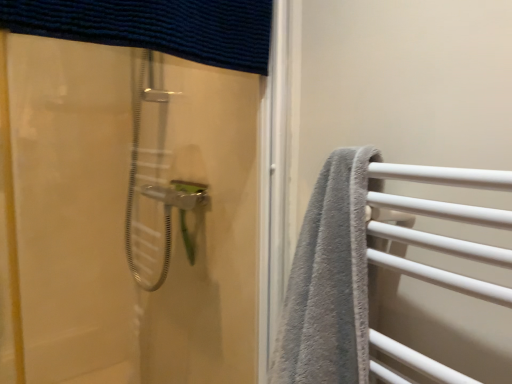
Measure the distance between gray fabric towel at right and camera.

They are 45.08 centimeters apart.

What do you see at coordinates (444, 175) in the screenshot? I see `gray fabric towel at right` at bounding box center [444, 175].

Where is `gray fabric towel at right`? The width and height of the screenshot is (512, 384). gray fabric towel at right is located at coordinates (444, 175).

The width and height of the screenshot is (512, 384). I want to click on gray fabric towel at right, so click(x=444, y=175).